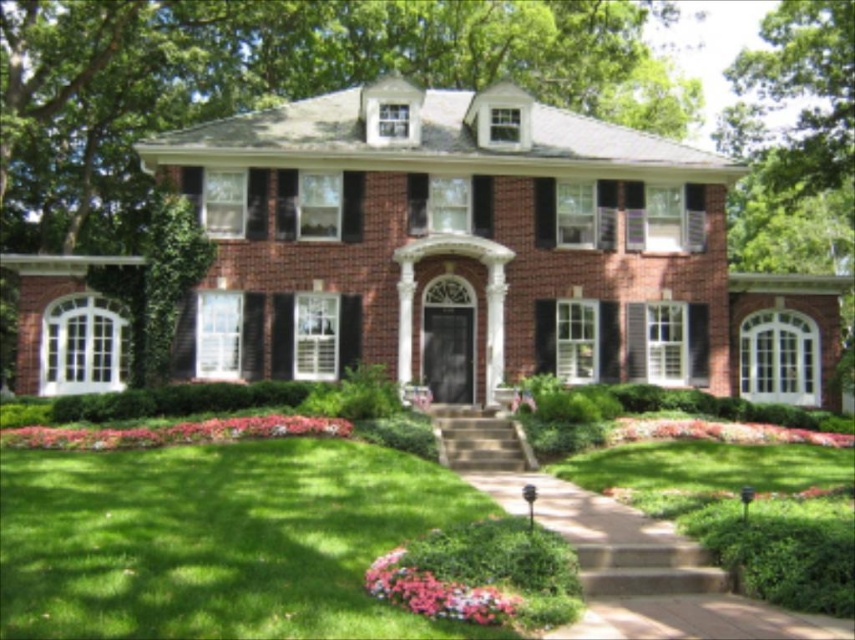
You are standing at the front door of the house and want to water the plants. Which object, the green leafy tree at upper center or the pink matte flowers at lower left, is closer to you?

The green leafy tree at upper center is closer to you because it is further to the viewer than the pink matte flowers at lower left.

You are standing at the front door of the house and want to walk to the pink floral bed at lower right. Which direction should you turn to face the green leafy tree at upper center?

You should turn to your left to face the green leafy tree at upper center because it is further to the viewer than the pink floral bed at lower right, meaning it is closer to you.

You are standing at the entrance of the two story brick house and looking towards the upper center. What object is located at the point with coordinates (275,81)?

The green leafy tree at upper center is located at point (275,81).